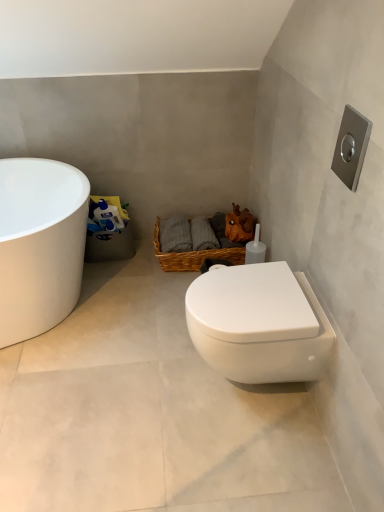
What are the coordinates of `white glossy bathtub at left` in the screenshot? It's located at (39, 244).

What do you see at coordinates (150, 413) in the screenshot? The image size is (384, 512). I see `white glossy toilet at lower right` at bounding box center [150, 413].

Describe the element at coordinates (259, 324) in the screenshot. The image size is (384, 512). I see `white glossy toilet at lower right` at that location.

What is the approximate height of woven brown basket at center?

It is 9.00 inches.

The image size is (384, 512). Identify the location of white glossy bathtub at left. (39, 244).

Is woven brown basket at center oriented away from white glossy toilet at lower right?

No, woven brown basket at center's orientation is not away from white glossy toilet at lower right.

Between woven brown basket at center and white glossy toilet at lower right, which one is positioned in front?

Positioned in front is white glossy toilet at lower right.

Looking at this image, is woven brown basket at center taller than white glossy toilet at lower right?

Indeed, woven brown basket at center has a greater height compared to white glossy toilet at lower right.

Are woven brown basket at center and white glossy toilet at lower right located far from each other?

No.

Would you say white glossy bathtub at left is inside or outside woven brown basket at center?

white glossy bathtub at left is not inside woven brown basket at center, it's outside.

From a real-world perspective, relative to woven brown basket at center, is white glossy bathtub at left vertically above or below?

white glossy bathtub at left is situated higher than woven brown basket at center in the real world.

Does white glossy bathtub at left have a smaller size compared to woven brown basket at center?

No.

From the image's perspective, between white glossy bathtub at left and woven brown basket at center, who is located below?

From the image's view, white glossy bathtub at left is below.

Considering the points (241, 362) and (61, 297), which point is behind, point (241, 362) or point (61, 297)?

The point (61, 297) is farther.

Is white glossy toilet at lower right far from white glossy bathtub at left?

No, white glossy toilet at lower right is in close proximity to white glossy bathtub at left.

From the picture: Is white glossy toilet at lower right oriented towards white glossy bathtub at left?

No, white glossy toilet at lower right does not turn towards white glossy bathtub at left.

Does point (165, 266) come in front of point (286, 362)?

No, it is not.

Looking at this image, from the image's perspective, which is above, woven brown basket at center or white glossy toilet at lower right?

woven brown basket at center is shown above in the image.

Is woven brown basket at center facing towards white glossy toilet at lower right?

No.

The image size is (384, 512). I want to click on toilet that is in front of the woven brown basket at center, so click(259, 324).

From a real-world perspective, which object rests below the other?

white glossy toilet at lower right, from a real-world perspective.

Does white glossy toilet at lower right have a greater height compared to white glossy bathtub at left?

In fact, white glossy toilet at lower right may be shorter than white glossy bathtub at left.

Is white glossy toilet at lower right far away from white glossy bathtub at left?

No.

Considering the sizes of objects white glossy toilet at lower right and white glossy bathtub at left in the image provided, who is wider, white glossy toilet at lower right or white glossy bathtub at left?

white glossy toilet at lower right.

Is white glossy bathtub at left taller or shorter than white glossy toilet at lower right?

white glossy bathtub at left is taller than white glossy toilet at lower right.

From the image's perspective, which is below, white glossy bathtub at left or white glossy toilet at lower right?

white glossy toilet at lower right.

Based on the photo, how different are the orientations of white glossy bathtub at left and white glossy toilet at lower right in degrees?

The angular difference between white glossy bathtub at left and white glossy toilet at lower right is 111 degrees.

Which is correct: white glossy bathtub at left is inside white glossy toilet at lower right, or outside of it?

white glossy bathtub at left is spatially situated outside white glossy toilet at lower right.

Is white glossy bathtub at left not near white glossy toilet at lower right?

No, white glossy bathtub at left is in close proximity to white glossy toilet at lower right.

In the image, is white glossy bathtub at left on the left side or the right side of white glossy toilet at lower right?

In the image, white glossy bathtub at left appears on the left side of white glossy toilet at lower right.

Is white glossy bathtub at left inside the boundaries of white glossy toilet at lower right, or outside?

white glossy bathtub at left is not enclosed by white glossy toilet at lower right.

Locate an element on the screen. This screenshot has height=512, width=384. concrete below the woven brown basket at center (from the image's perspective) is located at coordinates (150, 413).

At what (x,y) coordinates should I click in order to perform the action: click on bathtub in front of the woven brown basket at center. Please return your answer as a coordinate pair (x, y). Looking at the image, I should click on (39, 244).

Which object lies further to the anchor point white glossy toilet at lower right, white glossy toilet at lower right or woven brown basket at center?

The object further to white glossy toilet at lower right is woven brown basket at center.

When comparing their distances from white glossy toilet at lower right, does white glossy toilet at lower right or white glossy bathtub at left seem closer?

white glossy toilet at lower right lies closer to white glossy toilet at lower right than the other object.

Which object lies further to the anchor point woven brown basket at center, white glossy toilet at lower right or white glossy toilet at lower right?

white glossy toilet at lower right is positioned further to the anchor woven brown basket at center.

Looking at the image, which one is located further to woven brown basket at center, white glossy bathtub at left or white glossy toilet at lower right?

white glossy toilet at lower right is positioned further to the anchor woven brown basket at center.

Looking at the image, which one is located further to woven brown basket at center, white glossy toilet at lower right or white glossy toilet at lower right?

white glossy toilet at lower right.

Which object lies nearer to the anchor point white glossy toilet at lower right, white glossy bathtub at left or white glossy toilet at lower right?

white glossy toilet at lower right.

Based on their spatial positions, is white glossy toilet at lower right or woven brown basket at center closer to white glossy bathtub at left?

white glossy toilet at lower right is closer to white glossy bathtub at left.

Estimate the real-world distances between objects in this image. Which object is further from white glossy bathtub at left, white glossy toilet at lower right or white glossy toilet at lower right?

Based on the image, white glossy toilet at lower right appears to be further to white glossy bathtub at left.

Where is `basket between white glossy bathtub at left and white glossy toilet at lower right from left to right`? This screenshot has height=512, width=384. basket between white glossy bathtub at left and white glossy toilet at lower right from left to right is located at coordinates (193, 255).

At what (x,y) coordinates should I click in order to perform the action: click on bathtub located between white glossy toilet at lower right and woven brown basket at center in the depth direction. Please return your answer as a coordinate pair (x, y). Looking at the image, I should click on (39, 244).

The height and width of the screenshot is (512, 384). Find the location of `concrete between white glossy bathtub at left and white glossy toilet at lower right`. concrete between white glossy bathtub at left and white glossy toilet at lower right is located at coordinates (150, 413).

Where is `toilet between white glossy toilet at lower right and woven brown basket at center along the z-axis`? The height and width of the screenshot is (512, 384). toilet between white glossy toilet at lower right and woven brown basket at center along the z-axis is located at coordinates (259, 324).